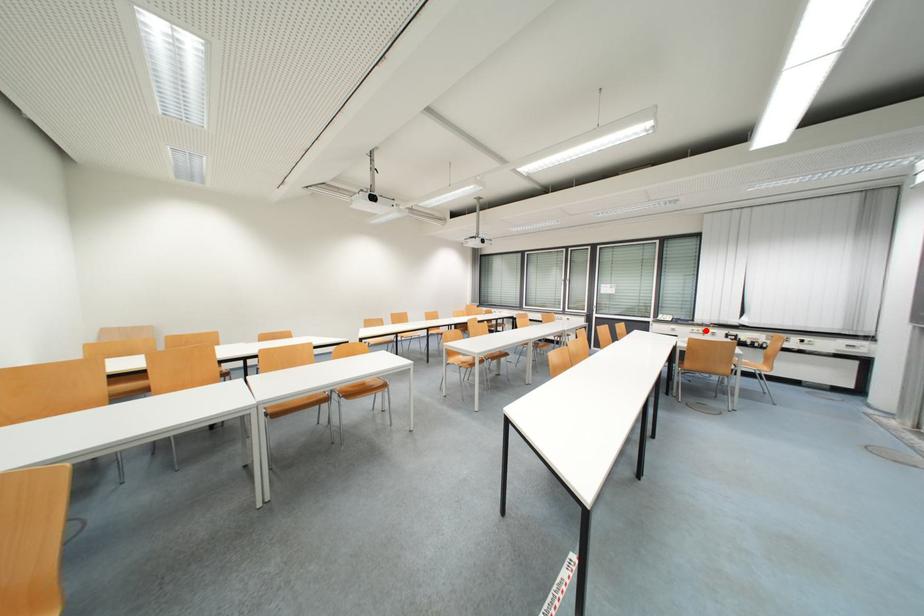
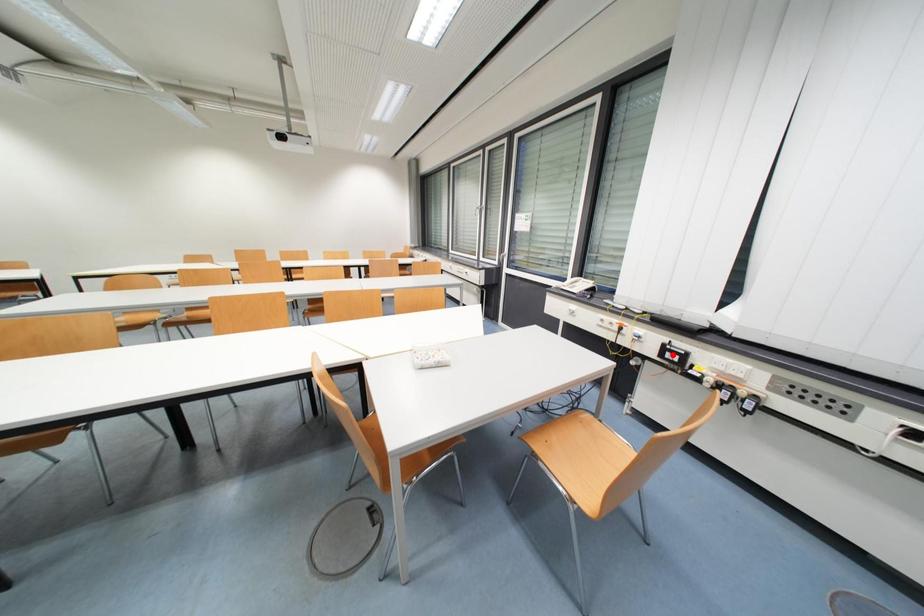
I am providing you with two images of the same scene from different viewpoints. A red point is marked on the first image and another point is marked on the second image. Are the points marked in image1 and image2 representing the same 3D position?

No